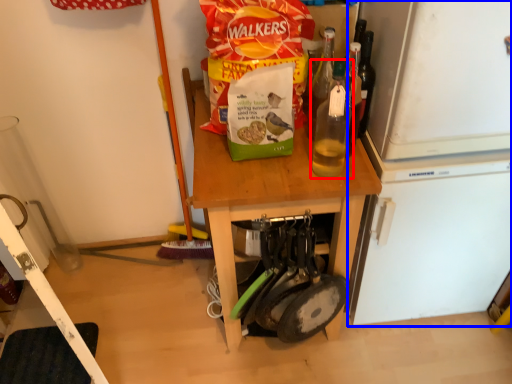
Question: Which object appears closest to the camera in this image, bottle (highlighted by a red box) or appliance (highlighted by a blue box)?

Choices:
 (A) bottle
 (B) appliance

Answer: (A)